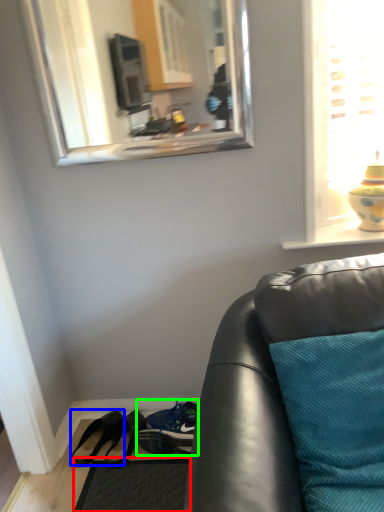
Question: Which object is positioned closest to flat (highlighted by a red box)? Select from footwear (highlighted by a blue box) and shoe (highlighted by a green box).

Choices:
 (A) footwear
 (B) shoe

Answer: (B)